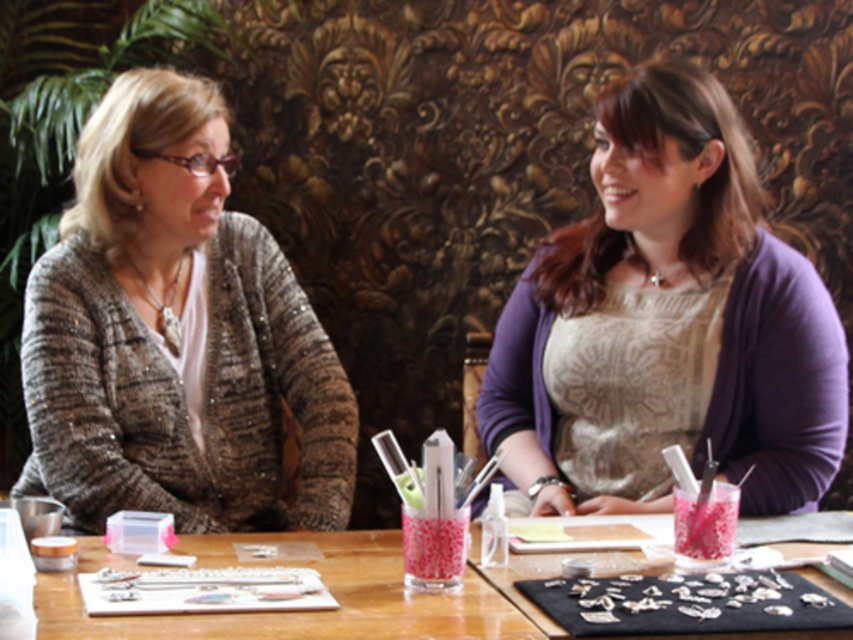
Question: Among these points, which one is farthest from the camera?

Choices:
 (A) (62, 412)
 (B) (627, 84)

Answer: (B)

Question: Among these points, which one is nearest to the camera?

Choices:
 (A) (305, 632)
 (B) (186, 342)
 (C) (845, 433)

Answer: (A)

Question: Which object is the closest to the purple textured sweater at center?

Choices:
 (A) sparkly gray cardigan at left
 (B) wooden table at center

Answer: (B)

Question: Observing the image, what is the correct spatial positioning of purple textured sweater at center in reference to sparkly gray cardigan at left?

Choices:
 (A) left
 (B) right

Answer: (B)

Question: Is sparkly gray cardigan at left closer to camera compared to wooden table at center?

Choices:
 (A) no
 (B) yes

Answer: (A)

Question: Is sparkly gray cardigan at left wider than wooden table at center?

Choices:
 (A) yes
 (B) no

Answer: (B)